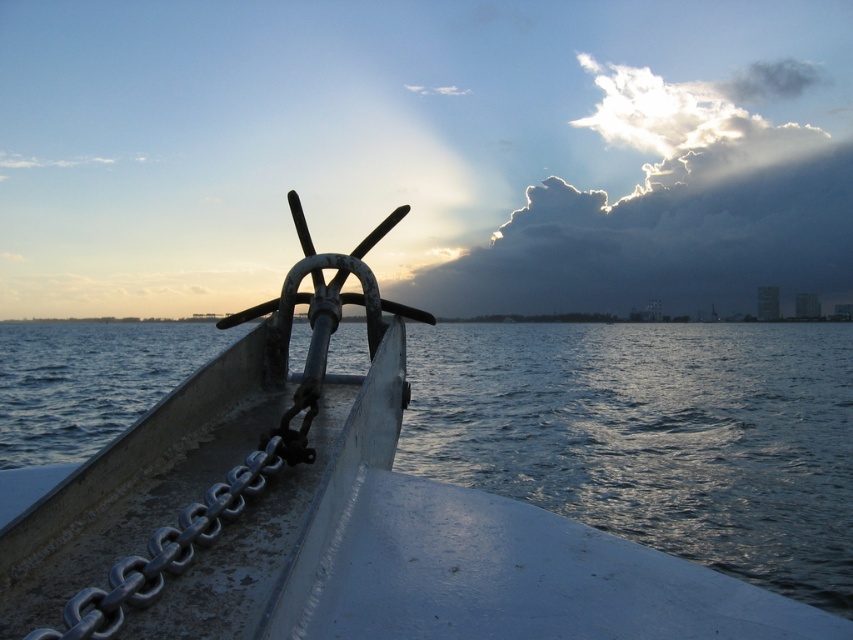
Question: Can you confirm if metallic chain anchor at center is wider than cloudy sky at upper center?

Choices:
 (A) no
 (B) yes

Answer: (A)

Question: Is metallic chain anchor at center to the right of cloudy sky at upper center from the viewer's perspective?

Choices:
 (A) no
 (B) yes

Answer: (A)

Question: Which object appears farthest from the camera in this image?

Choices:
 (A) cloudy sky at upper center
 (B) metallic chain anchor at center

Answer: (A)

Question: Which point is farther from the camera taking this photo?

Choices:
 (A) (711, 264)
 (B) (505, 513)

Answer: (A)

Question: Does metallic chain anchor at center appear over cloudy sky at upper center?

Choices:
 (A) no
 (B) yes

Answer: (A)